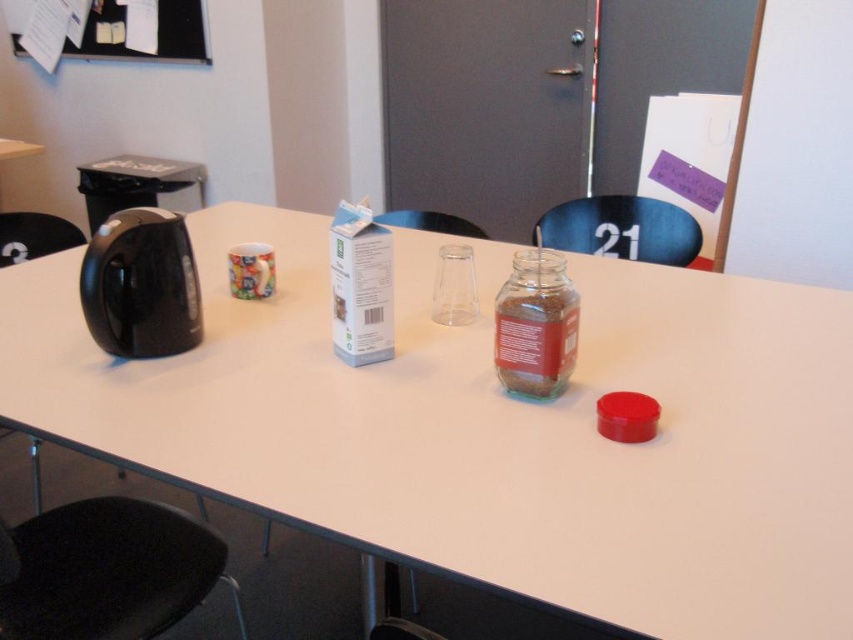
Question: Is black plastic chair at center bigger than transparent plastic cup at center?

Choices:
 (A) yes
 (B) no

Answer: (A)

Question: Which of the following is the closest to the observer?

Choices:
 (A) black plastic chair at center
 (B) black plastic chair at left
 (C) transparent plastic cup at center
 (D) transparent glass jar at center

Answer: (D)

Question: Which object appears farthest from the camera in this image?

Choices:
 (A) black plastic chair at lower left
 (B) white glossy table at center
 (C) transparent plastic cup at center

Answer: (C)

Question: Which of these objects is positioned farthest from the white glossy table at center?

Choices:
 (A) black plastic chair at lower left
 (B) transparent glass jar at center
 (C) black feltboard at upper left

Answer: (C)

Question: Is white glossy table at center positioned in front of transparent plastic cup at center?

Choices:
 (A) yes
 (B) no

Answer: (A)

Question: Does black plastic chair at lower left appear on the right side of black feltboard at upper left?

Choices:
 (A) no
 (B) yes

Answer: (B)